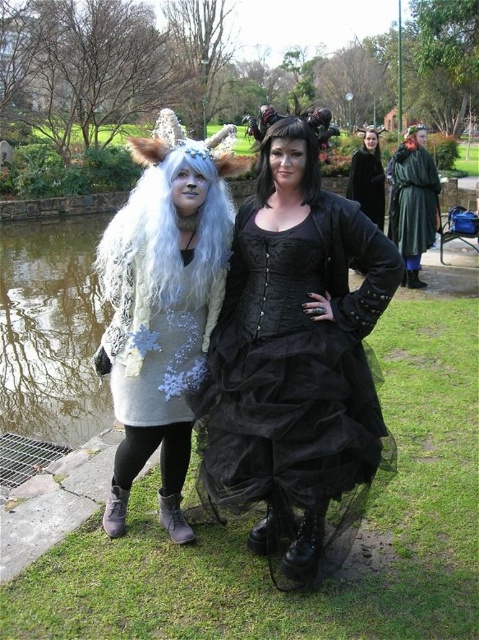
Question: Is black tulle dress at center closer to camera compared to white fluffy wig at left?

Choices:
 (A) no
 (B) yes

Answer: (B)

Question: Can you confirm if black tulle dress at center is bigger than green velvet cloak at right?

Choices:
 (A) no
 (B) yes

Answer: (A)

Question: Which object is farther from the camera taking this photo?

Choices:
 (A) black velvet dress at center
 (B) fuzzy white scarf at left

Answer: (A)

Question: Which point is farther to the camera?

Choices:
 (A) fuzzy white scarf at left
 (B) black satin wig at center
 (C) fuzzy white fur coat at left

Answer: (C)

Question: Is transparent glass pond at left positioned in front of green velvet cloak at right?

Choices:
 (A) no
 (B) yes

Answer: (B)

Question: Which of the following is the closest to the observer?

Choices:
 (A) (371, 176)
 (B) (312, 323)
 (C) (421, 161)

Answer: (B)